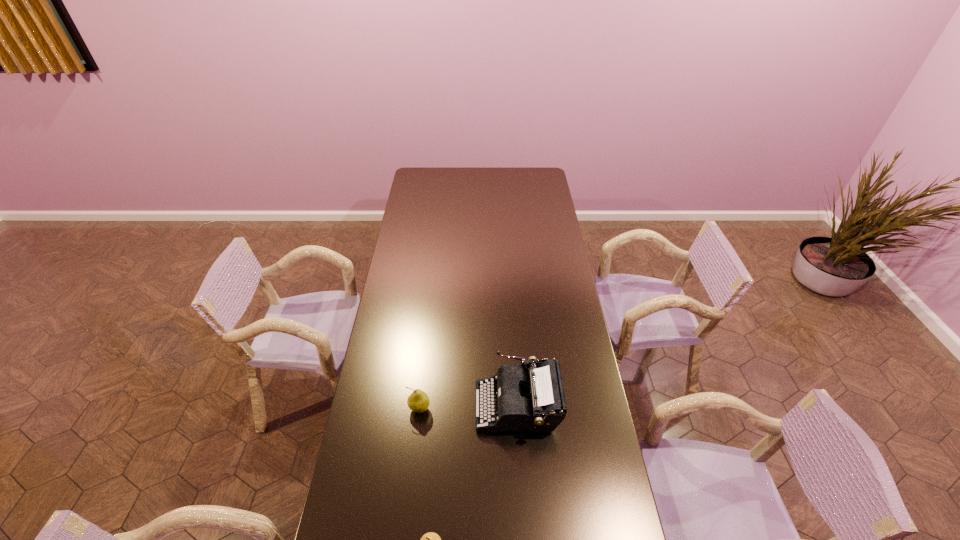
This screenshot has width=960, height=540. I want to click on the rightmost object, so click(x=530, y=397).

What are the coordinates of `typewriter` in the screenshot? It's located at (530, 397).

Identify the location of the left pear. This screenshot has width=960, height=540. (418, 401).

Locate an element on the screen. This screenshot has height=540, width=960. the leftmost object is located at coordinates (418, 401).

Locate an element on the screen. This screenshot has width=960, height=540. vacant area situated 0.340m on the typing side of the rightmost object is located at coordinates point(378,405).

At what (x,y) coordinates should I click in order to perform the action: click on free space located 0.400m on the typing side of the rightmost object. Please return your answer as a coordinate pair (x, y). Image resolution: width=960 pixels, height=540 pixels. Looking at the image, I should click on (361, 405).

At what (x,y) coordinates should I click in order to perform the action: click on free space located on the typing side of the rightmost object. Please return your answer as a coordinate pair (x, y). Looking at the image, I should click on (375, 405).

Where is `vacant region located 0.120m on the right of the leftmost object`? vacant region located 0.120m on the right of the leftmost object is located at coordinates 466,409.

This screenshot has width=960, height=540. Find the location of `object located in the left edge section of the desktop`. object located in the left edge section of the desktop is located at coordinates (418, 401).

Where is `object that is at the right edge`? The width and height of the screenshot is (960, 540). object that is at the right edge is located at coordinates pos(530,397).